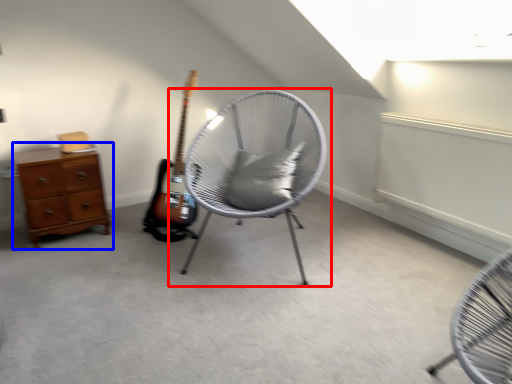
Question: Which point is further to the camera, chair (highlighted by a red box) or chest of drawers (highlighted by a blue box)?

Choices:
 (A) chair
 (B) chest of drawers

Answer: (B)